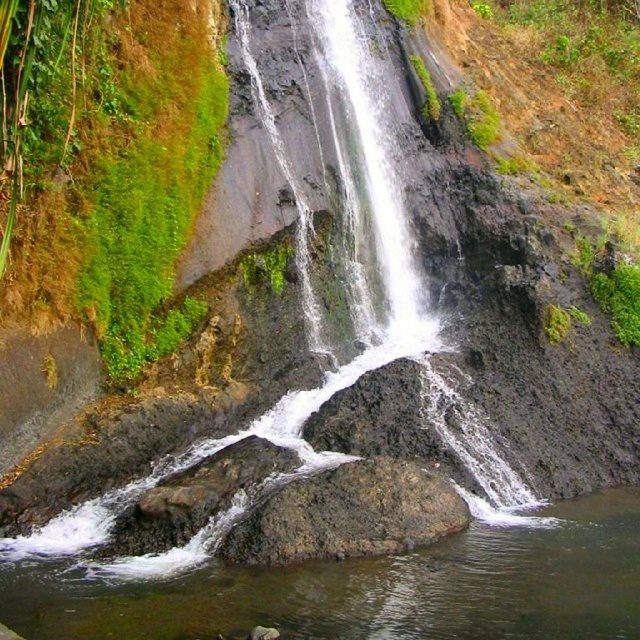
Question: Which point is farther to the camera?

Choices:
 (A) (132, 586)
 (B) (56, 104)

Answer: (B)

Question: Where is green mossy rock at left located in relation to gray rough rock at center in the image?

Choices:
 (A) right
 (B) left

Answer: (B)

Question: Which object appears closest to the camera in this image?

Choices:
 (A) clear water at rock center
 (B) green mossy rock at left

Answer: (A)

Question: Can you confirm if green mossy rock at left is thinner than clear water at rock center?

Choices:
 (A) no
 (B) yes

Answer: (A)

Question: Does green mossy rock at left appear on the right side of gray rough rock at center?

Choices:
 (A) no
 (B) yes

Answer: (A)

Question: Among these objects, which one is farthest from the camera?

Choices:
 (A) gray rough rock at center
 (B) green mossy rock at left
 (C) clear water at rock center

Answer: (B)